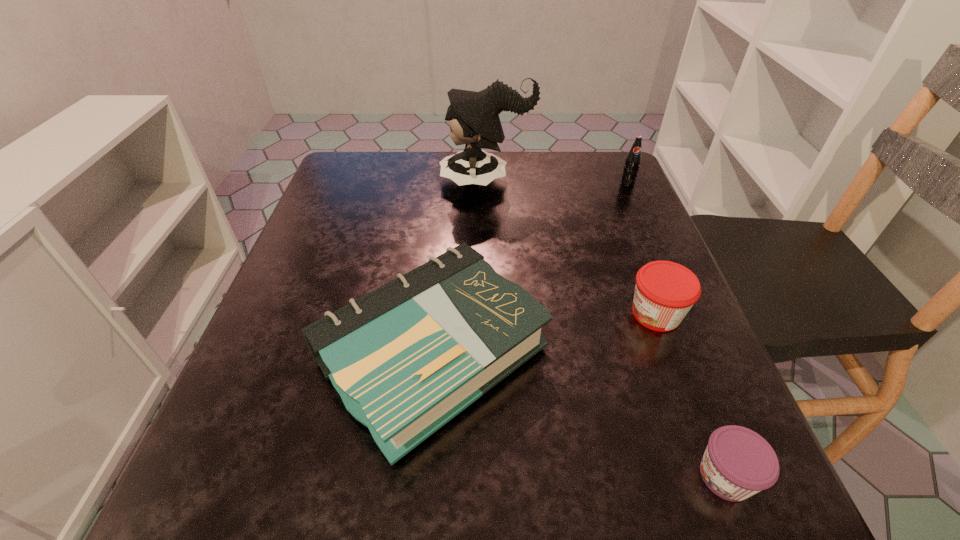
You are a GUI agent. You are given a task and a screenshot of the screen. Output one action in this format:
    pyautogui.click(x=<x>, y=<y>)
    Task: Click on the jam that is at the near edge
    
    Given the screenshot: What is the action you would take?
    pyautogui.click(x=738, y=463)

Find the location of a particular element. Image resolution: width=960 pixels, height=540 pixels. object that is at the left edge is located at coordinates (406, 358).

Locate an element on the screen. pop present at the right edge is located at coordinates (632, 162).

Locate an element on the screen. The width and height of the screenshot is (960, 540). object at the near left corner is located at coordinates (406, 358).

Locate an element on the screen. This screenshot has width=960, height=540. object that is at the far right corner is located at coordinates (632, 162).

Identify the location of object at the near right corner. Image resolution: width=960 pixels, height=540 pixels. (738, 463).

This screenshot has width=960, height=540. Find the location of `vacant region at the far edge of the desktop`. vacant region at the far edge of the desktop is located at coordinates (416, 154).

You are a GUI agent. You are given a task and a screenshot of the screen. Output one action in this format:
    pyautogui.click(x=<x>, y=<y>)
    Task: Click on the vacant space at the left edge of the desktop
    The image size is (960, 540).
    Given the screenshot: What is the action you would take?
    pyautogui.click(x=375, y=202)

In the image, there is a desktop. What are the coordinates of `vacant space at the right edge` in the screenshot? It's located at (625, 283).

The width and height of the screenshot is (960, 540). What are the coordinates of `vacant space at the far left corner of the desktop` in the screenshot? It's located at (348, 180).